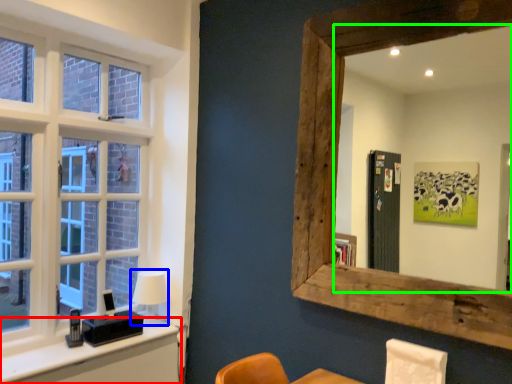
Question: Considering the real-world distances, which object is farthest from vanity (highlighted by a red box)? table lamp (highlighted by a blue box) or mirror (highlighted by a green box)?

Choices:
 (A) table lamp
 (B) mirror

Answer: (B)